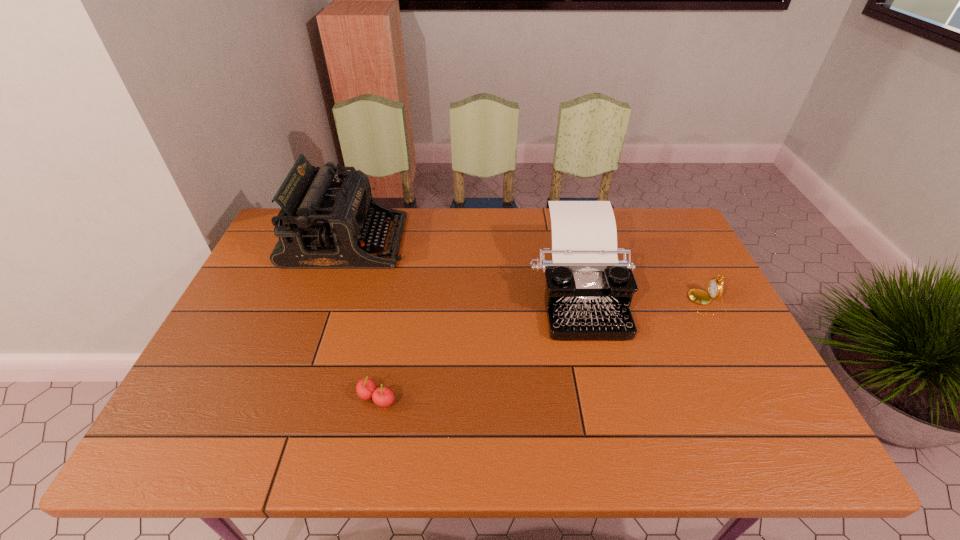
Locate an element on the screen. Image resolution: width=960 pixels, height=540 pixels. blank space located 0.060m on the face of the pocket watch is located at coordinates (669, 303).

Find the location of a particular element. The image size is (960, 540). vacant space located on the face of the pocket watch is located at coordinates (640, 303).

Identify the location of vacant area situated 0.080m on the left of the cherry. The width and height of the screenshot is (960, 540). (323, 399).

Locate an element on the screen. The width and height of the screenshot is (960, 540). object located at the left edge is located at coordinates (323, 224).

Where is `object at the right edge`? object at the right edge is located at coordinates (715, 288).

Locate an element on the screen. The height and width of the screenshot is (540, 960). object located at the far left corner is located at coordinates (323, 224).

Where is `free space at the far edge of the desktop`? This screenshot has width=960, height=540. free space at the far edge of the desktop is located at coordinates (436, 250).

Locate an element on the screen. The height and width of the screenshot is (540, 960). vacant position at the near edge of the desktop is located at coordinates pyautogui.click(x=287, y=433).

Where is `free location at the right edge`? The height and width of the screenshot is (540, 960). free location at the right edge is located at coordinates (666, 253).

Where is `free point at the near left corner`? This screenshot has width=960, height=540. free point at the near left corner is located at coordinates (233, 433).